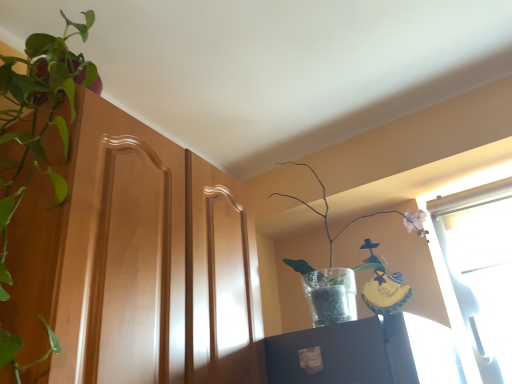
Question: Does translucent glass vase at upper right, the 2th houseplant viewed from the left, have a greater width compared to wooden cabinet at left?

Choices:
 (A) yes
 (B) no

Answer: (B)

Question: Is translucent glass vase at upper right, positioned as the first houseplant in right-to-left order, facing away from wooden cabinet at left?

Choices:
 (A) yes
 (B) no

Answer: (B)

Question: Can you confirm if translucent glass vase at upper right, the 2th houseplant viewed from the left, is bigger than wooden cabinet at left?

Choices:
 (A) no
 (B) yes

Answer: (A)

Question: Does translucent glass vase at upper right, the 2th houseplant viewed from the left, have a smaller size compared to wooden cabinet at left?

Choices:
 (A) yes
 (B) no

Answer: (A)

Question: Are translucent glass vase at upper right, the 2th houseplant viewed from the left, and wooden cabinet at left far apart?

Choices:
 (A) no
 (B) yes

Answer: (A)

Question: Can we say translucent glass vase at upper right, positioned as the first houseplant in right-to-left order, lies outside wooden cabinet at left?

Choices:
 (A) yes
 (B) no

Answer: (A)

Question: Does green leafy plant at left, arranged as the 2th houseplant when viewed from the right, turn towards translucent glass vase at upper right, positioned as the first houseplant in right-to-left order?

Choices:
 (A) no
 (B) yes

Answer: (A)

Question: Is green leafy plant at left, arranged as the 2th houseplant when viewed from the right, wider than translucent glass vase at upper right, the 2th houseplant viewed from the left?

Choices:
 (A) no
 (B) yes

Answer: (A)

Question: Is green leafy plant at left, the first houseplant positioned from the left, shorter than translucent glass vase at upper right, the 2th houseplant viewed from the left?

Choices:
 (A) no
 (B) yes

Answer: (A)

Question: From a real-world perspective, is green leafy plant at left, arranged as the 2th houseplant when viewed from the right, positioned under translucent glass vase at upper right, positioned as the first houseplant in right-to-left order, based on gravity?

Choices:
 (A) no
 (B) yes

Answer: (A)

Question: Does green leafy plant at left, the first houseplant positioned from the left, touch translucent glass vase at upper right, positioned as the first houseplant in right-to-left order?

Choices:
 (A) no
 (B) yes

Answer: (A)

Question: Considering the relative positions of green leafy plant at left, arranged as the 2th houseplant when viewed from the right, and translucent glass vase at upper right, positioned as the first houseplant in right-to-left order, in the image provided, is green leafy plant at left, arranged as the 2th houseplant when viewed from the right, to the right of translucent glass vase at upper right, positioned as the first houseplant in right-to-left order, from the viewer's perspective?

Choices:
 (A) no
 (B) yes

Answer: (A)

Question: From the image's perspective, does translucent glass vase at upper right, positioned as the first houseplant in right-to-left order, appear higher than green leafy plant at left, the first houseplant positioned from the left?

Choices:
 (A) no
 (B) yes

Answer: (A)